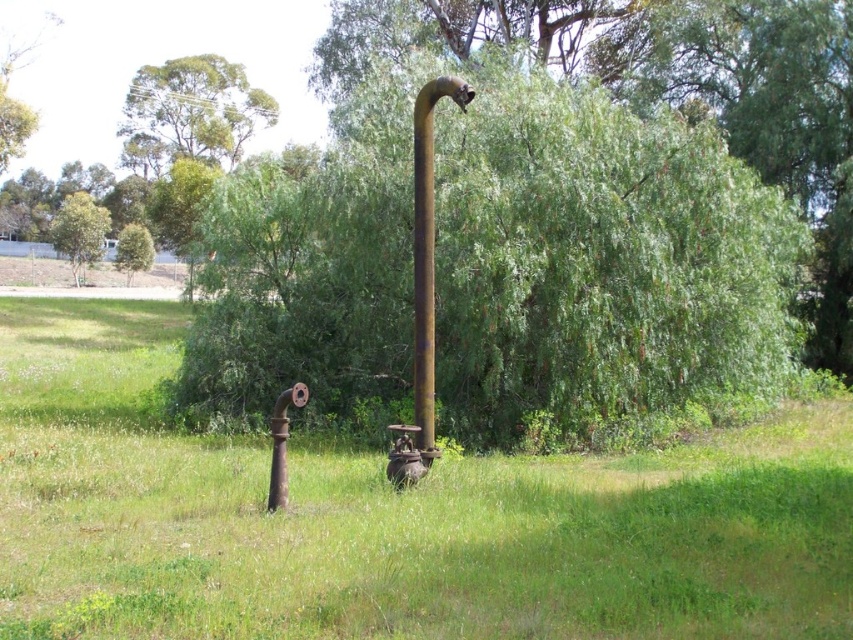
You are a construction worker needing to choose between the rusty metal pipe at center and the rusty metal pole at center for a project that requires a wider material. Which one should you choose?

The rusty metal pipe at center has a larger width than the rusty metal pole at center, so you should choose the rusty metal pipe at center for your project.

You are standing at the origin point of the image. Which direction should you move to reach the rusty metal pipe at center?

The rusty metal pipe at center is located at point 0.809 on the x axis and 0.456 on the y axis. Since you are at the origin point, you should move towards the right and slightly upwards to reach it.

You are a maintenance worker inspecting the area. You need to determine which object is shorter between the rusty metal pipe at center and the rusty metal pole at center. Which one is shorter?

The rusty metal pipe at center is not as tall as the rusty metal pole at center, so the rusty metal pipe at center is shorter.